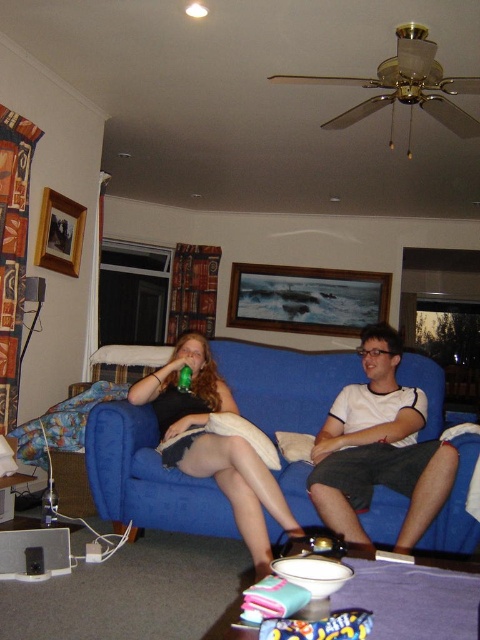
Is the position of white cotton t-shirt at center less distant than that of matte black dress at center?

No, it is not.

Is white cotton t-shirt at center above matte black dress at center?

Correct, white cotton t-shirt at center is located above matte black dress at center.

At what (x,y) coordinates should I click in order to perform the action: click on white cotton t-shirt at center. Please return your answer as a coordinate pair (x, y). Image resolution: width=480 pixels, height=640 pixels. Looking at the image, I should click on (379, 449).

Does blue fabric couch at center appear over matte black dress at center?

No.

This screenshot has height=640, width=480. What do you see at coordinates (146, 477) in the screenshot?
I see `blue fabric couch at center` at bounding box center [146, 477].

What are the coordinates of `blue fabric couch at center` in the screenshot? It's located at point(146,477).

Is blue fabric couch at center thinner than white cotton t-shirt at center?

Incorrect, blue fabric couch at center's width is not less than white cotton t-shirt at center's.

Looking at this image, does blue fabric couch at center come behind white cotton t-shirt at center?

Yes, blue fabric couch at center is further from the viewer.

Which is in front, point (236, 355) or point (333, 476)?

Point (333, 476) is more forward.

This screenshot has width=480, height=640. I want to click on blue fabric couch at center, so click(146, 477).